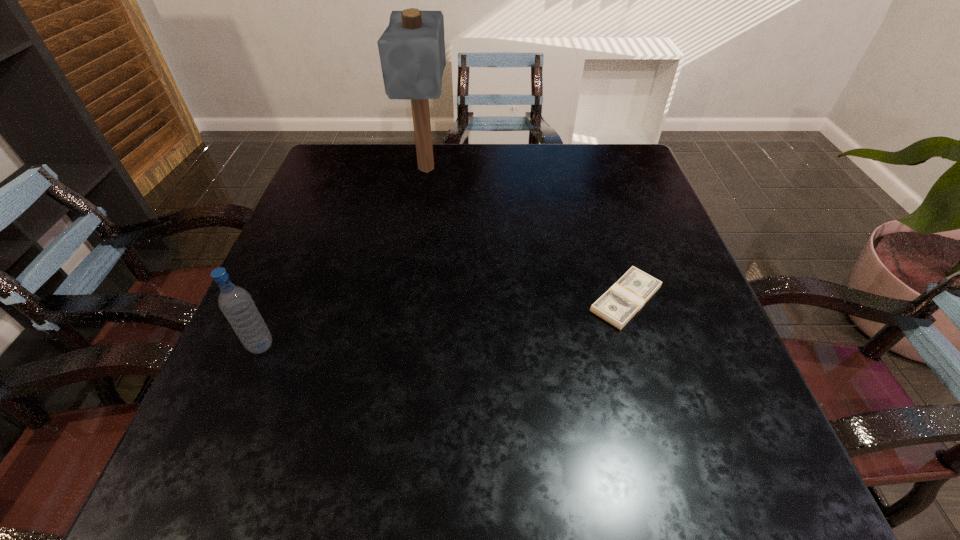
You are a GUI agent. You are given a task and a screenshot of the screen. Output one action in this format:
    pyautogui.click(x=<x>, y=<y>)
    Task: Click on the mallet
    The height and width of the screenshot is (540, 960).
    Given the screenshot: What is the action you would take?
    pyautogui.click(x=412, y=48)

Find the location of a particular element. the farthest object is located at coordinates pos(412,48).

I want to click on the second shortest object, so click(x=236, y=304).

Identify the location of the nearest object. point(236,304).

I want to click on the shortest object, so click(x=628, y=295).

Where is `dollar`? dollar is located at coordinates (628, 295).

Image resolution: width=960 pixels, height=540 pixels. In order to click on free space located on the right of the tallest object in this screenshot , I will do `click(475, 168)`.

Locate an element on the screen. The height and width of the screenshot is (540, 960). free space located on the back of the leftmost object is located at coordinates (315, 216).

I want to click on vacant area situated on the front of the dollar, so click(x=654, y=389).

I want to click on object present at the far edge, so click(x=412, y=48).